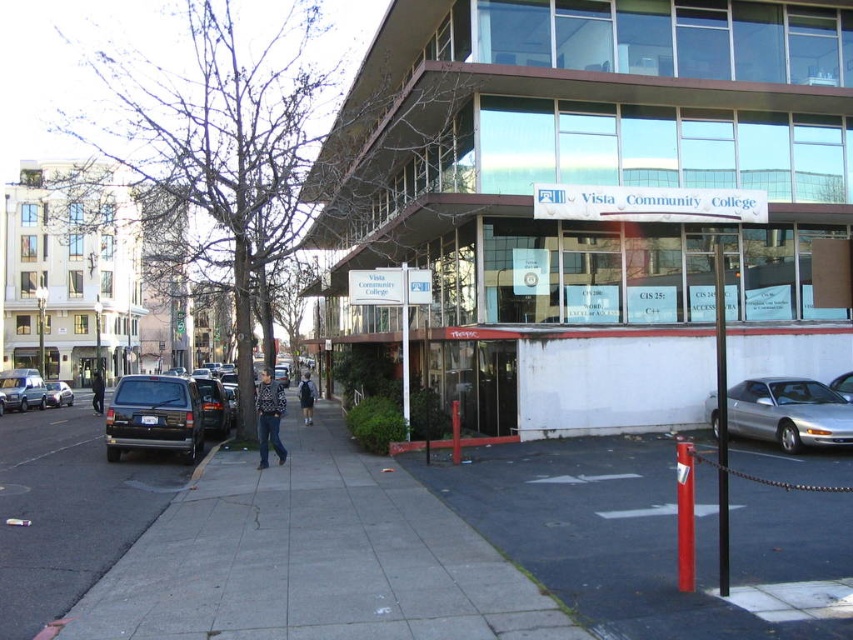
Question: Is dark gray backpack at center positioned in front of matte black van at lower left?

Choices:
 (A) no
 (B) yes

Answer: (B)

Question: Can you confirm if gray concrete sidewalk at center is thinner than dark gray backpack at center?

Choices:
 (A) yes
 (B) no

Answer: (A)

Question: Estimate the real-world distances between objects in this image. Which object is farther from the black asphalt at lower left?

Choices:
 (A) patterned sweater at center
 (B) dark blue jeans at center
 (C) shiny black suv at left
 (D) matte black van at lower left

Answer: (D)

Question: Is the position of patterned sweater at center more distant than that of dark gray backpack at center?

Choices:
 (A) no
 (B) yes

Answer: (A)

Question: Which is nearer to the metallic silver van at left?

Choices:
 (A) shiny black suv at left
 (B) smooth asphalt pavement at lower center
 (C) patterned sweater at center
 (D) silver metallic car at lower right

Answer: (C)

Question: Estimate the real-world distances between objects in this image. Which object is closer to the shiny black suv at left?

Choices:
 (A) metallic silver van at left
 (B) dark gray backpack at center

Answer: (B)